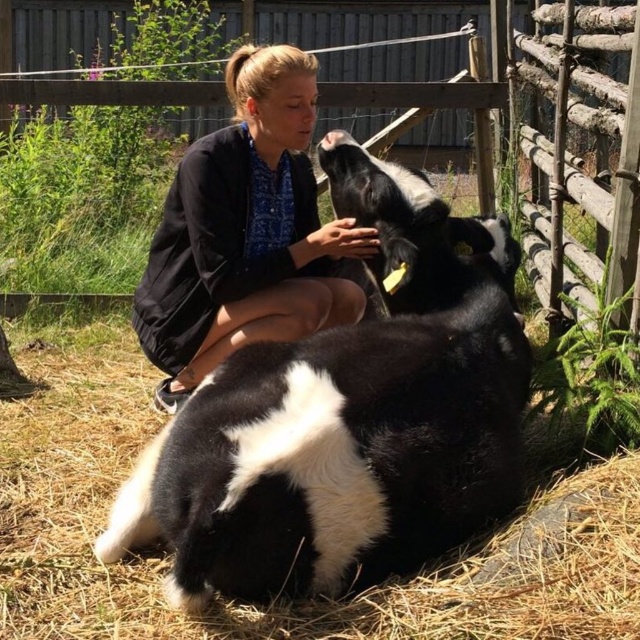
Is black cotton shorts at center positioned at the back of wooden fence at upper center?

No.

Who is higher up, black cotton shorts at center or wooden fence at upper center?

wooden fence at upper center is higher up.

Locate an element on the screen. Image resolution: width=640 pixels, height=640 pixels. black cotton shorts at center is located at coordinates (244, 232).

The height and width of the screenshot is (640, 640). Identify the location of black cotton shorts at center. point(244,232).

What are the coordinates of `black and white fur at center` in the screenshot? It's located at (348, 419).

Describe the element at coordinates (348, 419) in the screenshot. I see `black and white fur at center` at that location.

Find the location of a particular element. This screenshot has height=640, width=640. black and white fur at center is located at coordinates (348, 419).

Between black and white fur at center and wooden fence at upper center, which one is positioned lower?

black and white fur at center is below.

Identify the location of black and white fur at center. (348, 419).

The height and width of the screenshot is (640, 640). In order to click on black and white fur at center in this screenshot , I will do tap(348, 419).